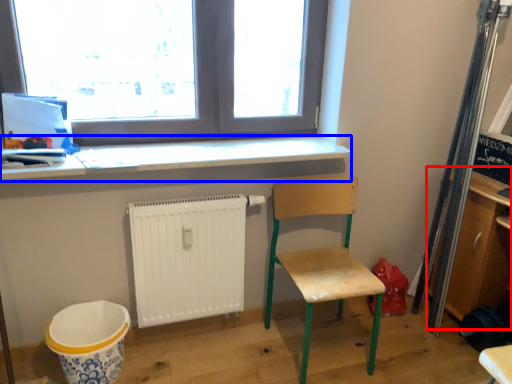
Question: Which object appears closest to the camera in this image, shelf (highlighted by a red box) or counter top (highlighted by a blue box)?

Choices:
 (A) shelf
 (B) counter top

Answer: (B)